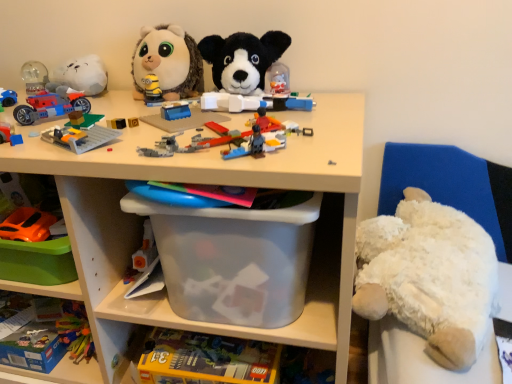
Identify the location of vacant space in translucent plastic lego pieces at center, the fourth toy in the bottom-to-top sequence (from a real-world perspective). (234, 134).